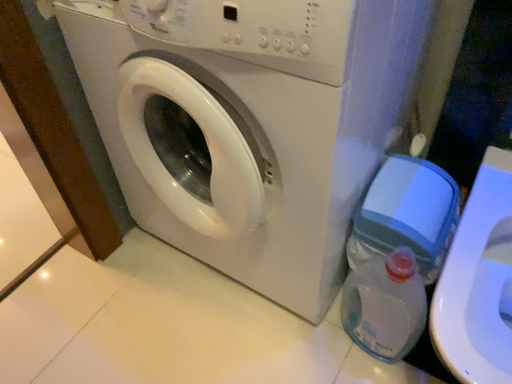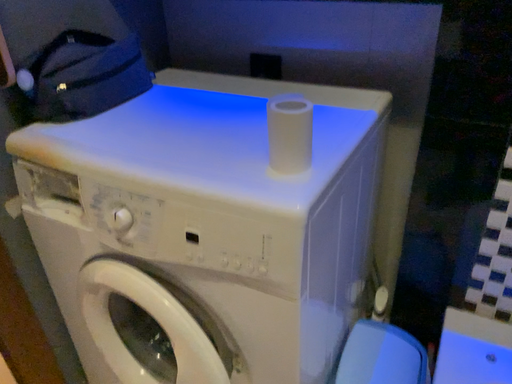
Question: How did the camera likely rotate when shooting the video?

Choices:
 (A) rotated downward
 (B) rotated upward

Answer: (B)